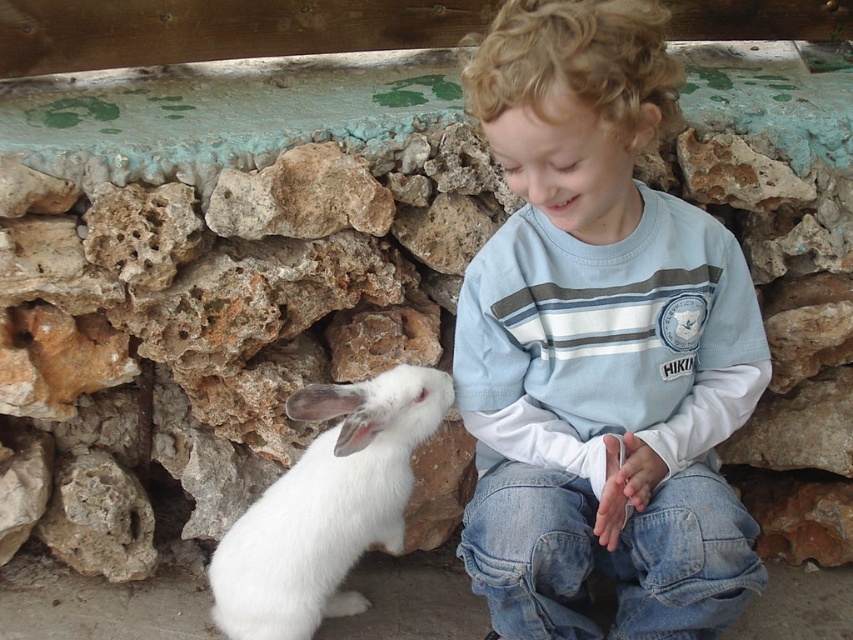
Question: Is light blue cotton shirt at center to the right of white fluffy rabbit at left from the viewer's perspective?

Choices:
 (A) no
 (B) yes

Answer: (B)

Question: Which of the following is the farthest from the observer?

Choices:
 (A) (724, 374)
 (B) (312, 467)

Answer: (B)

Question: Can you confirm if light blue cotton shirt at center is positioned to the left of white fluffy rabbit at left?

Choices:
 (A) no
 (B) yes

Answer: (A)

Question: Which point appears farthest from the camera in this image?

Choices:
 (A) (337, 387)
 (B) (657, 289)

Answer: (A)

Question: Is light blue cotton shirt at center positioned behind white fluffy rabbit at left?

Choices:
 (A) yes
 (B) no

Answer: (B)